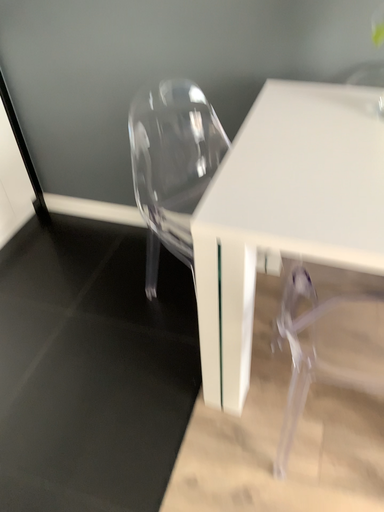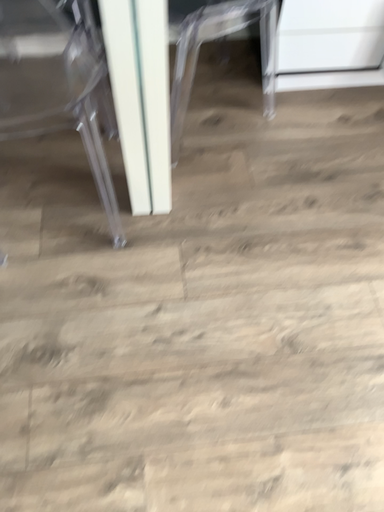
Question: Which way did the camera rotate in the video?

Choices:
 (A) rotated left
 (B) rotated right

Answer: (B)